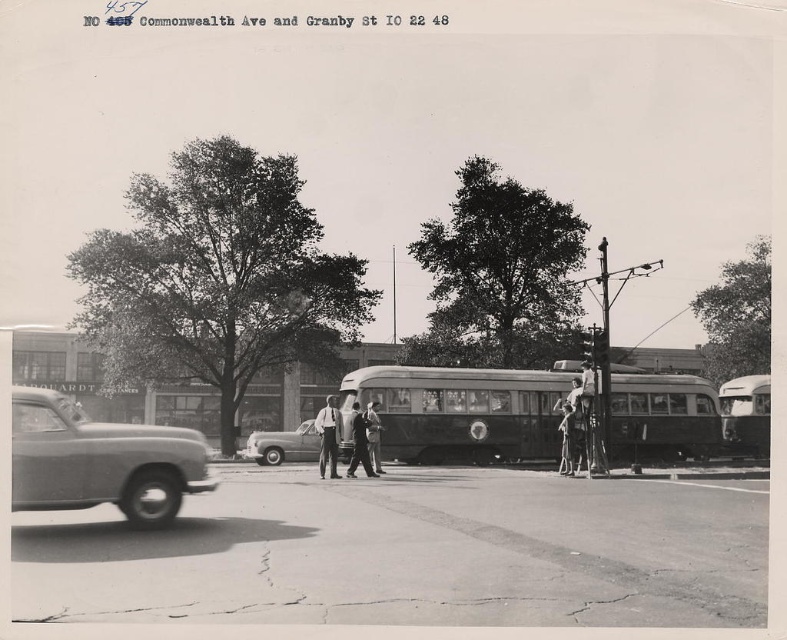
Based on the coordinates provided in the description, where is the shiny silver sedan at center located in the image?

The shiny silver sedan at center is located at coordinates point (283, 445).

You are a pedestrian standing at the intersection of Commonwealth Ave and Granby St. You see a dark gray metal bus at center and a smooth leather jacket at center. Which object is higher in the image?

The dark gray metal bus at center is above the smooth leather jacket at center, so the dark gray metal bus at center is higher in the image.

Based on the scene described, which bus, the dark gray metal bus at center or the metallic silver bus at right, would likely block the view of a person standing behind it when looking towards the road?

The dark gray metal bus at center is much taller than the metallic silver bus at right, so it would block the view more effectively.